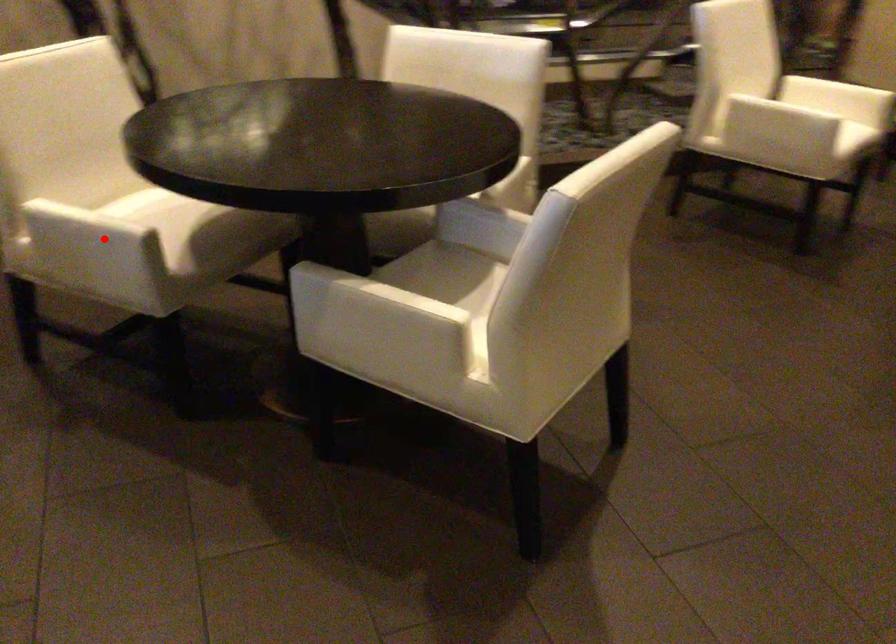
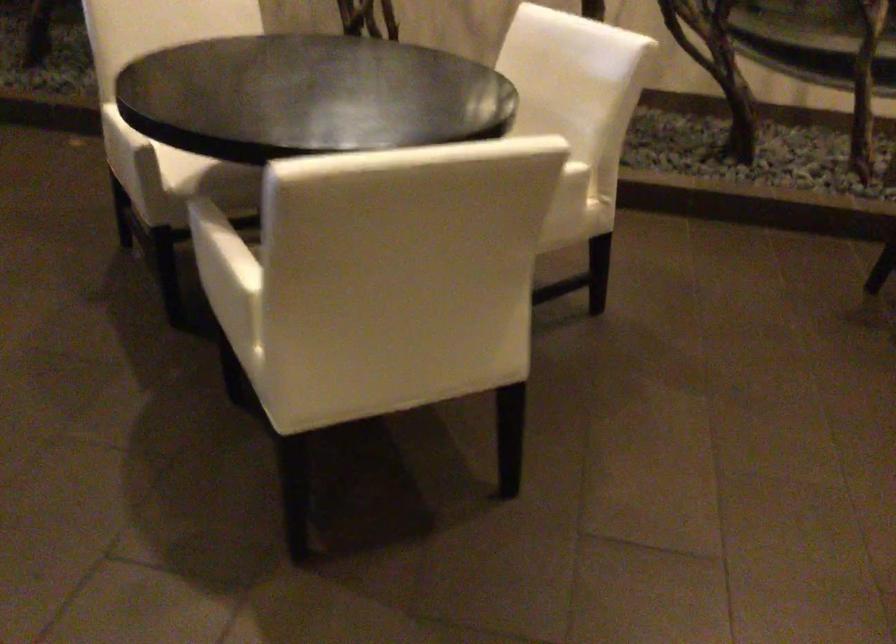
In the second image, find the point that corresponds to the highlighted location in the first image.

(118, 138)